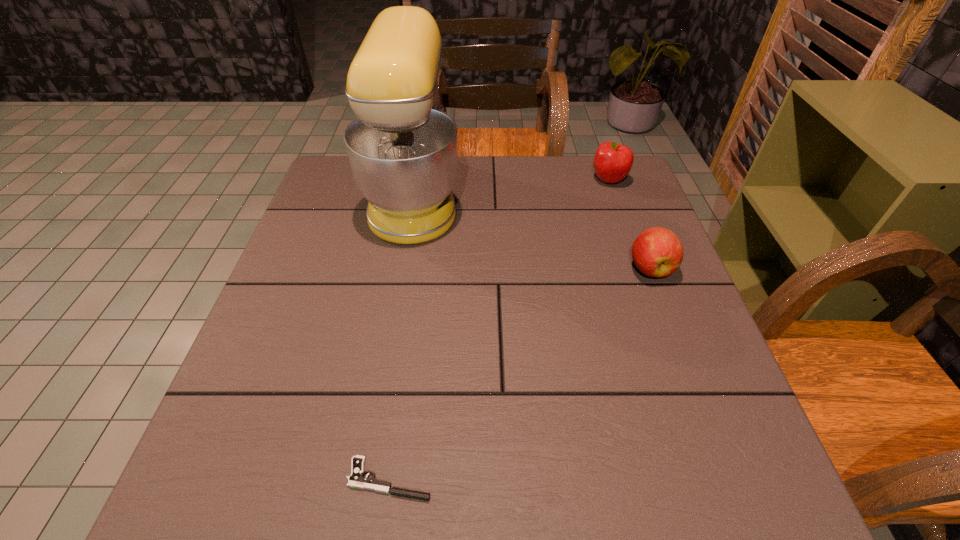
Image resolution: width=960 pixels, height=540 pixels. In the image, there is a desktop. In order to click on blank space at the right edge in this screenshot , I will do `click(624, 309)`.

In the image, there is a desktop. Where is `vacant space at the far left corner`? vacant space at the far left corner is located at coordinates (351, 181).

What are the coordinates of `vacant space at the far right corner of the desktop` in the screenshot? It's located at (590, 178).

The image size is (960, 540). I want to click on empty space that is in between the pistol and the farther apple, so click(x=499, y=329).

This screenshot has width=960, height=540. I want to click on blank region between the pistol and the farther apple, so click(x=499, y=329).

Where is `free spot between the mixer and the farther apple`? This screenshot has height=540, width=960. free spot between the mixer and the farther apple is located at coordinates (512, 188).

Find the location of `empty location between the second nearest object and the nearest object`. empty location between the second nearest object and the nearest object is located at coordinates (520, 374).

Where is `vacant area that lies between the second nearest object and the tallest object`? vacant area that lies between the second nearest object and the tallest object is located at coordinates (533, 232).

This screenshot has width=960, height=540. Identify the location of free space between the farther apple and the pistol. (499, 329).

This screenshot has height=540, width=960. What are the coordinates of `free spot between the nearest object and the third farthest object` in the screenshot? It's located at (520, 374).